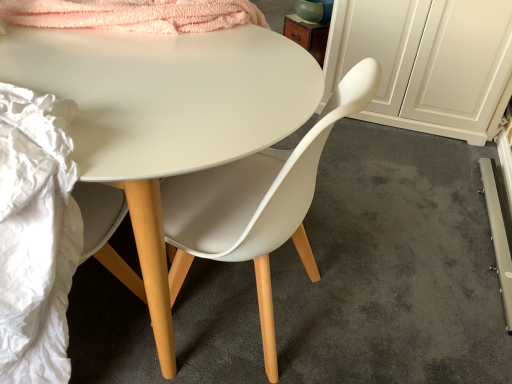
Question: Considering the relative sizes of white matte desk at center and white matte cabinet at right in the image provided, is white matte desk at center bigger than white matte cabinet at right?

Choices:
 (A) no
 (B) yes

Answer: (B)

Question: Is white matte desk at center shorter than white matte cabinet at right?

Choices:
 (A) yes
 (B) no

Answer: (B)

Question: From a real-world perspective, is white matte desk at center positioned under white matte cabinet at right based on gravity?

Choices:
 (A) no
 (B) yes

Answer: (A)

Question: From the image's perspective, is white matte desk at center located above white matte cabinet at right?

Choices:
 (A) yes
 (B) no

Answer: (B)

Question: Is white matte desk at center to the left of white matte cabinet at right from the viewer's perspective?

Choices:
 (A) no
 (B) yes

Answer: (B)

Question: Does white matte desk at center have a smaller size compared to white matte cabinet at right?

Choices:
 (A) yes
 (B) no

Answer: (B)

Question: Is white matte cabinet at right oriented away from white matte desk at center?

Choices:
 (A) no
 (B) yes

Answer: (A)

Question: Does white matte cabinet at right have a greater width compared to white matte desk at center?

Choices:
 (A) no
 (B) yes

Answer: (A)

Question: Does white matte cabinet at right have a lesser width compared to white matte desk at center?

Choices:
 (A) yes
 (B) no

Answer: (A)

Question: Can you confirm if white matte cabinet at right is smaller than white matte desk at center?

Choices:
 (A) yes
 (B) no

Answer: (A)

Question: Can you confirm if white matte cabinet at right is shorter than white matte desk at center?

Choices:
 (A) no
 (B) yes

Answer: (B)

Question: Can white matte desk at center be found inside white matte cabinet at right?

Choices:
 (A) no
 (B) yes

Answer: (A)

Question: Is white matte cabinet at right located outside matte white chair at center?

Choices:
 (A) no
 (B) yes

Answer: (B)